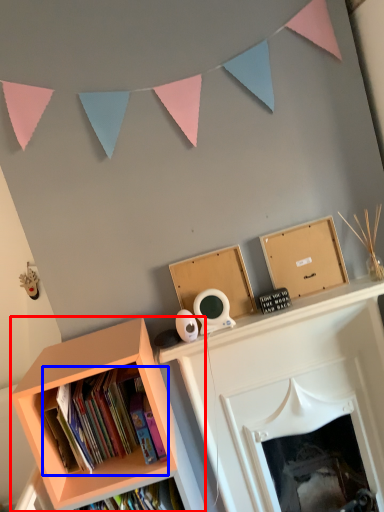
Question: Among these objects, which one is farthest to the camera, bookcase (highlighted by a red box) or book (highlighted by a blue box)?

Choices:
 (A) bookcase
 (B) book

Answer: (B)